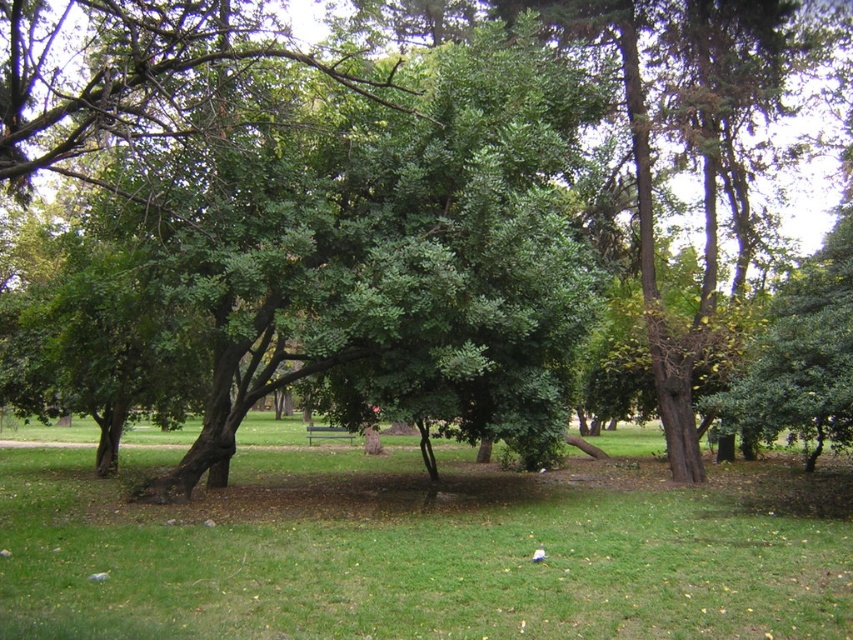
Based on the photo, is green grassy at center smaller than metallic silver bench at center?

Actually, green grassy at center might be larger than metallic silver bench at center.

Does point (595, 586) lie in front of point (314, 435)?

Yes.

Where is `green grassy at center`? This screenshot has width=853, height=640. green grassy at center is located at coordinates (419, 547).